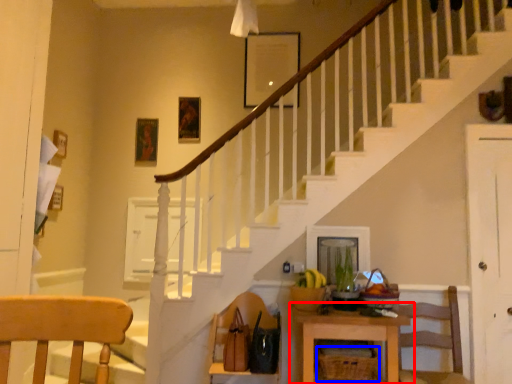
Question: Which of the following is the closest to the observer, table (highlighted by a red box) or basket (highlighted by a blue box)?

Choices:
 (A) table
 (B) basket

Answer: (A)